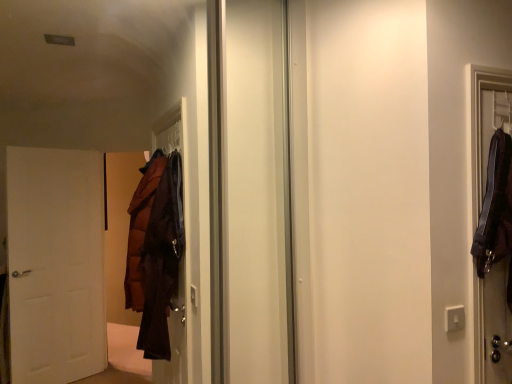
What do you see at coordinates (454, 318) in the screenshot?
I see `white plastic electric outlet at lower right` at bounding box center [454, 318].

Locate an element on the screen. Image resolution: width=512 pixels, height=384 pixels. white plastic electric outlet at lower right is located at coordinates (454, 318).

Identify the location of white plastic electric outlet at lower right. This screenshot has height=384, width=512. (454, 318).